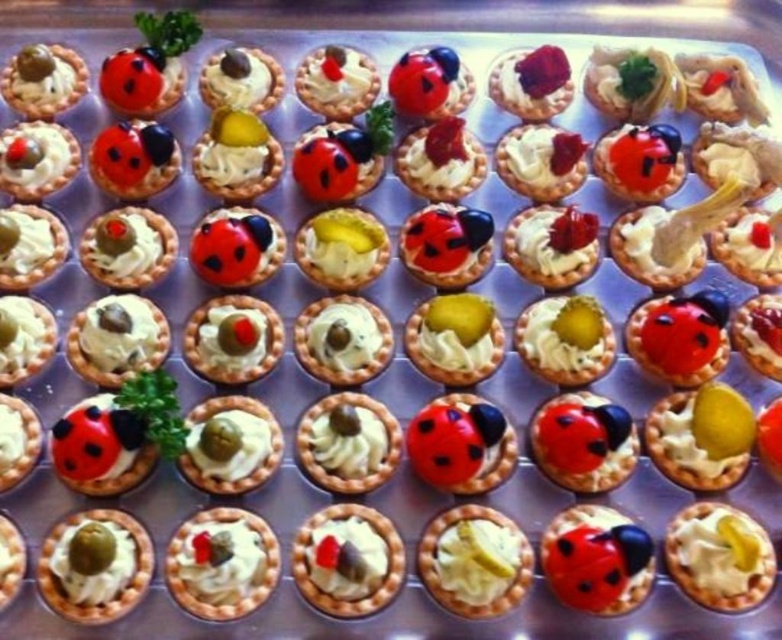
You are a chef arranging tartlets on a tray. You need to place a green matte olive at lower left and a matte black ladybug at center. According to the current arrangement, where should you position the green matte olive relative to the matte black ladybug?

The green matte olive at lower left should be placed to the left of the matte black ladybug at center.